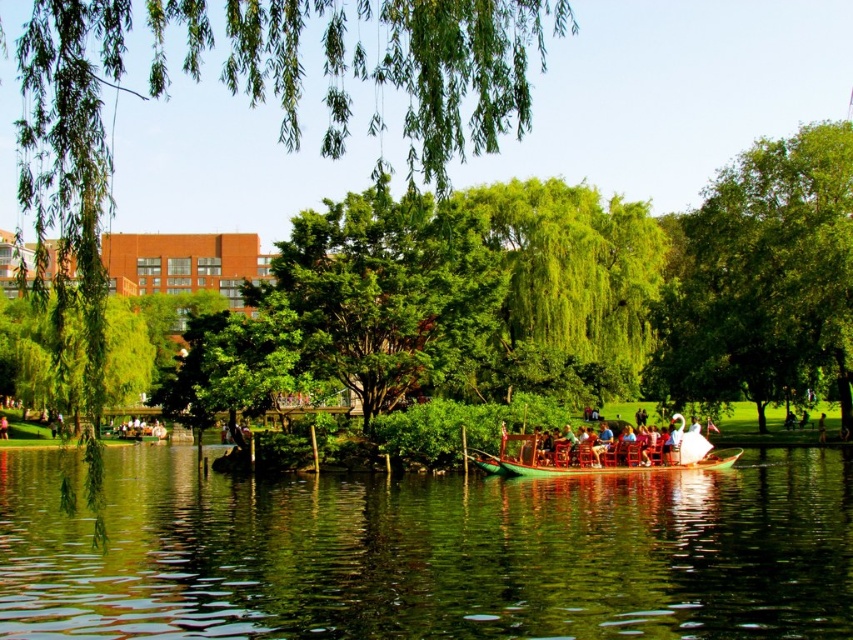
You are a park visitor standing at the edge of the water. You want to take a photo of the green leafy tree at center. Where should you position yourself to capture the tree in the center of your camera viewfinder?

To capture the green leafy tree at center in the center of your camera viewfinder, position yourself directly facing the tree at the coordinates specified by its 2D location point at [265,90].